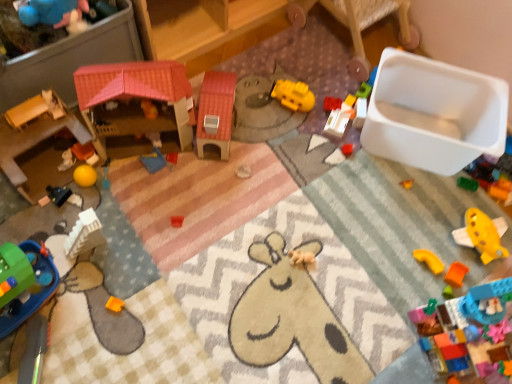
This screenshot has height=384, width=512. I want to click on free area in between yellow plastic block at upper center, the fifth toy from the right, and black plastic toy at lower left, arranged as the 3th toy when viewed from the left, so click(227, 147).